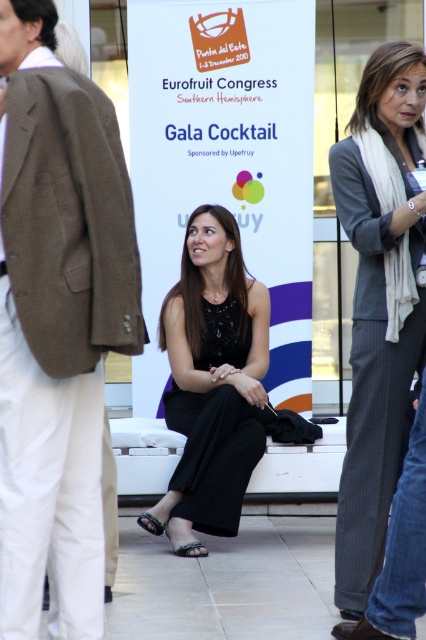
Who is lower down, brown checkered blazer at left or black satin dress at center?

black satin dress at center

In the scene shown: Can you confirm if brown checkered blazer at left is shorter than black satin dress at center?

No.

The height and width of the screenshot is (640, 426). What are the coordinates of `brown checkered blazer at left` in the screenshot? It's located at (57, 323).

I want to click on brown checkered blazer at left, so click(57, 323).

Does black satin dress at center appear on the left side of gray pinstripe blazer at right?

Yes, black satin dress at center is to the left of gray pinstripe blazer at right.

Does black satin dress at center lie in front of gray pinstripe blazer at right?

That is False.

What do you see at coordinates (212, 381) in the screenshot? The image size is (426, 640). I see `black satin dress at center` at bounding box center [212, 381].

Locate an element on the screen. This screenshot has height=640, width=426. black satin dress at center is located at coordinates (212, 381).

Can you confirm if brown checkered blazer at left is positioned to the right of gray pinstripe blazer at right?

In fact, brown checkered blazer at left is to the left of gray pinstripe blazer at right.

In the scene shown: Is brown checkered blazer at left smaller than gray pinstripe blazer at right?

No, brown checkered blazer at left is not smaller than gray pinstripe blazer at right.

Locate an element on the screen. Image resolution: width=426 pixels, height=640 pixels. brown checkered blazer at left is located at coordinates (57, 323).

Find the location of a particular element. This screenshot has height=640, width=426. brown checkered blazer at left is located at coordinates (x=57, y=323).